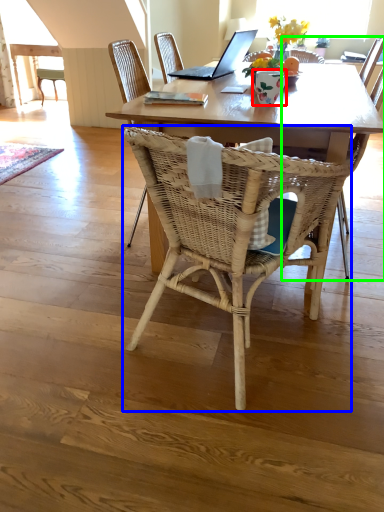
Question: Which object is the farthest from vase (highlighted by a red box)? Choose among these: chair (highlighted by a blue box) or armchair (highlighted by a green box).

Choices:
 (A) chair
 (B) armchair

Answer: (A)